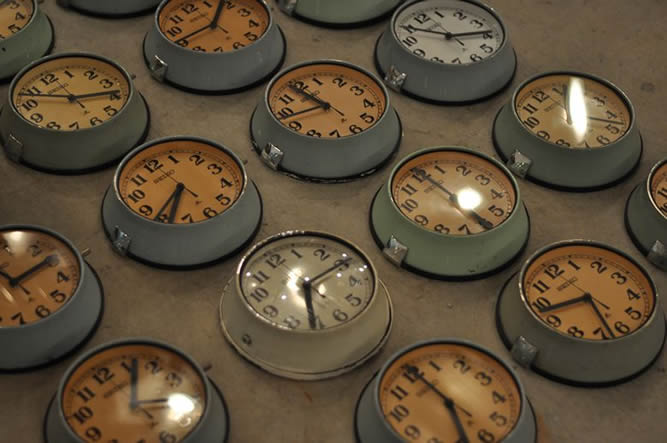
Locate an element on the screen. This screenshot has width=667, height=443. clock 3 is located at coordinates (123, 402).